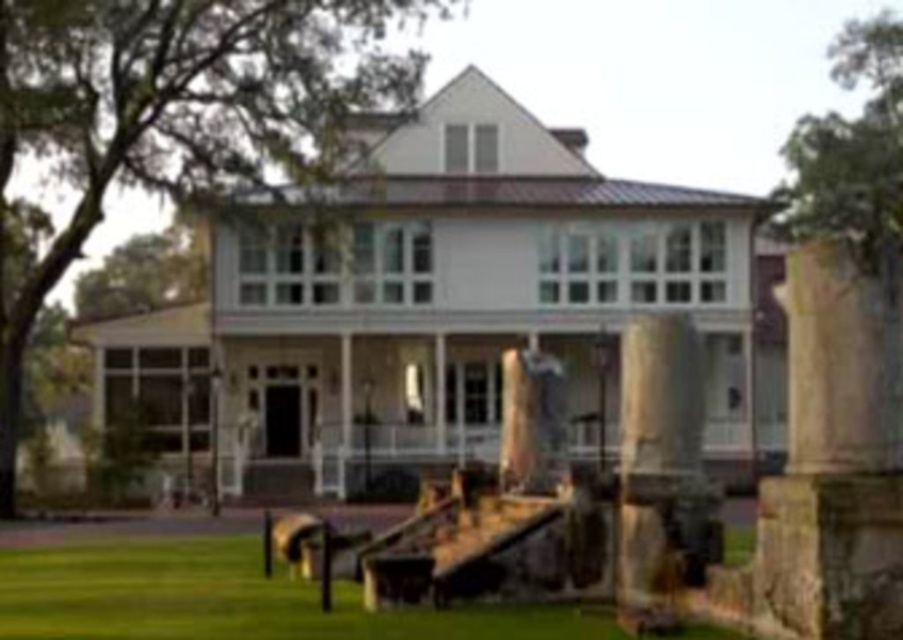
You are standing in front of the house and want to locate the beige stone column at right. According to the coordinates provided, where should you look relative to the house?

The beige stone column at right is located at the lower right corner of the house, as its coordinates are closer to the bottom right edge of the image.

You are standing in front of the house and want to walk from the beige stone column at right to the brown stone pillar at center. Which direction should you move?

You should move to the left because the beige stone column at right is to the right of the brown stone pillar at center, so moving left will bring you towards the center pillar.

From the picture: You are planning to place a new bench in the garden. The bench requires a space wider than the brown stone pillar at center. Can the green grass at lower left accommodate the bench?

→ The green grass at lower left is wider than the brown stone pillar at center, so it can accommodate the bench requiring space wider than the brown stone pillar at center.